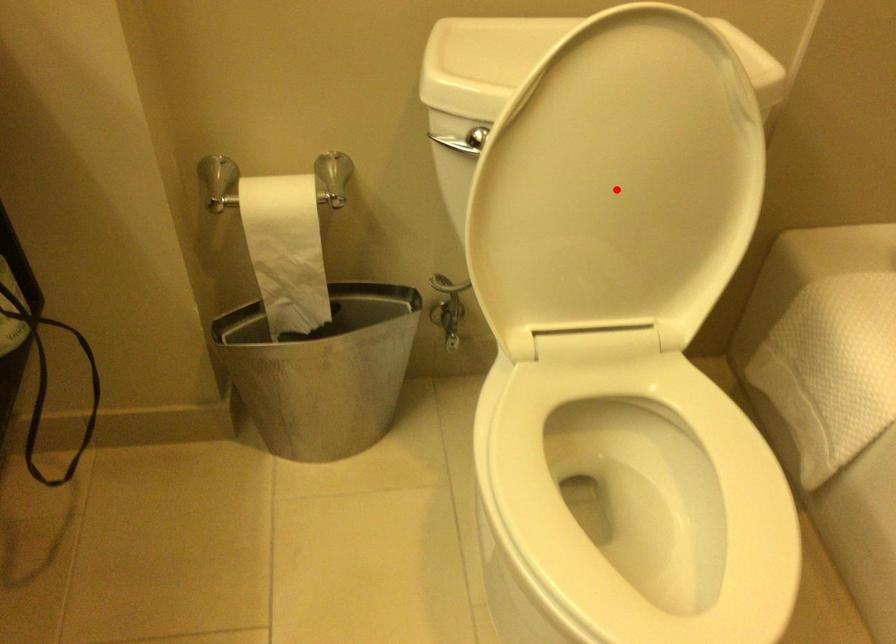
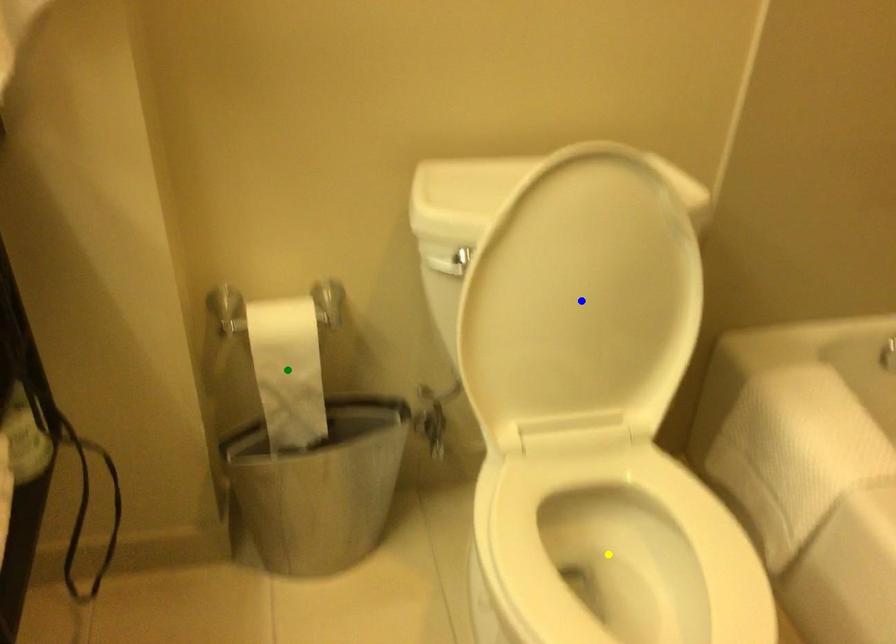
Question: I am providing you with two images of the same scene from different viewpoints. A red point is marked on the first image. You are given multiple points on the second image. Which point in image 2 represents the same 3d spot as the red point in image 1?

Choices:
 (A) green point
 (B) yellow point
 (C) blue point

Answer: (C)